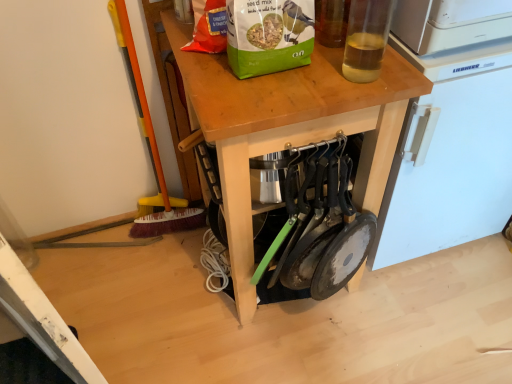
Locate an element on the screen. The width and height of the screenshot is (512, 384). vacant space to the left of green matte paper bag at upper center is located at coordinates point(203,68).